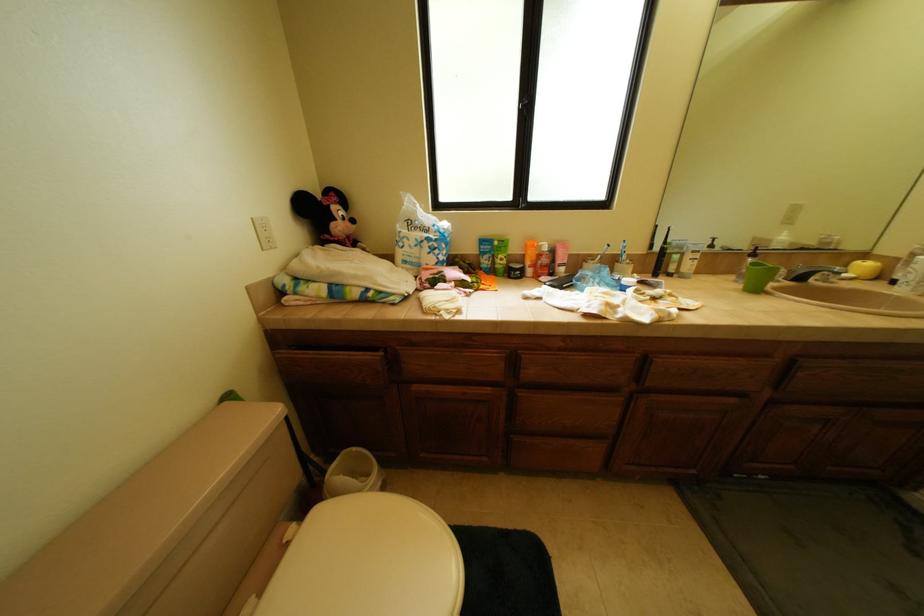
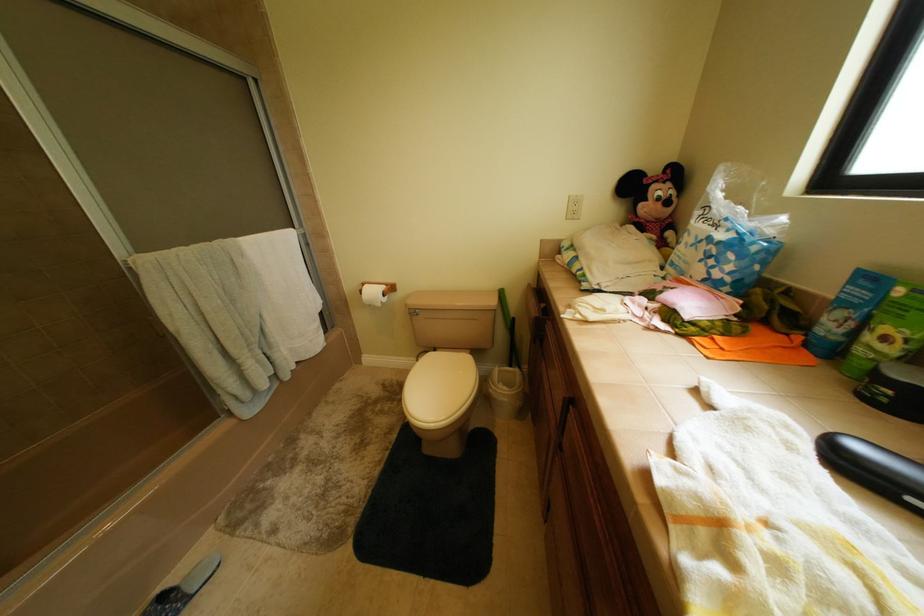
How did the camera likely rotate?

The camera's rotation is toward left-down.